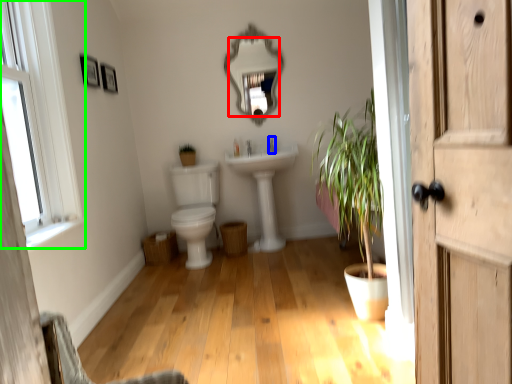
Question: Which is farther away from mirror (highlighted by a red box)? faucet (highlighted by a blue box) or window (highlighted by a green box)?

Choices:
 (A) faucet
 (B) window

Answer: (B)